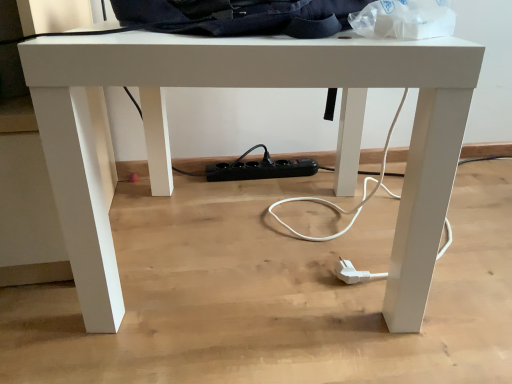
What do you see at coordinates (239, 16) in the screenshot?
I see `dark blue fabric messenger bag at upper center` at bounding box center [239, 16].

Identify the location of dark blue fabric messenger bag at upper center. (239, 16).

The image size is (512, 384). Identify the location of transparent plastic bag at upper right. pyautogui.click(x=404, y=19).

Describe the element at coordinates (404, 19) in the screenshot. Image resolution: width=512 pixels, height=384 pixels. I see `transparent plastic bag at upper right` at that location.

Identify the location of dark blue fabric messenger bag at upper center. The image size is (512, 384). (239, 16).

Can you confirm if dark blue fabric messenger bag at upper center is positioned to the right of transparent plastic bag at upper right?

No.

Between dark blue fabric messenger bag at upper center and transparent plastic bag at upper right, which one is positioned behind?

dark blue fabric messenger bag at upper center.

Between point (354, 6) and point (387, 22), which one is positioned behind?

The point (354, 6) is farther.

From the image's perspective, between dark blue fabric messenger bag at upper center and transparent plastic bag at upper right, who is located below?

transparent plastic bag at upper right is shown below in the image.

From a real-world perspective, is dark blue fabric messenger bag at upper center positioned above or below transparent plastic bag at upper right?

Clearly, from a real-world perspective, dark blue fabric messenger bag at upper center is above transparent plastic bag at upper right.

Does dark blue fabric messenger bag at upper center have a greater width compared to transparent plastic bag at upper right?

Correct, the width of dark blue fabric messenger bag at upper center exceeds that of transparent plastic bag at upper right.

Is dark blue fabric messenger bag at upper center taller than transparent plastic bag at upper right?

Incorrect, the height of dark blue fabric messenger bag at upper center is not larger of that of transparent plastic bag at upper right.

Considering the sizes of objects dark blue fabric messenger bag at upper center and transparent plastic bag at upper right in the image provided, who is bigger, dark blue fabric messenger bag at upper center or transparent plastic bag at upper right?

dark blue fabric messenger bag at upper center.

Is dark blue fabric messenger bag at upper center positioned beyond the bounds of transparent plastic bag at upper right?

Yes, dark blue fabric messenger bag at upper center is located beyond the bounds of transparent plastic bag at upper right.

Is dark blue fabric messenger bag at upper center far from transparent plastic bag at upper right?

No, dark blue fabric messenger bag at upper center is not far away from transparent plastic bag at upper right.

Does dark blue fabric messenger bag at upper center turn towards transparent plastic bag at upper right?

Yes, dark blue fabric messenger bag at upper center faces towards transparent plastic bag at upper right.

How many degrees apart are the facing directions of dark blue fabric messenger bag at upper center and transparent plastic bag at upper right?

They differ by 0.0001 degrees in their facing directions.

This screenshot has height=384, width=512. Find the location of `paper bag in front of the dark blue fabric messenger bag at upper center`. paper bag in front of the dark blue fabric messenger bag at upper center is located at coordinates (404, 19).

Considering the relative positions of transparent plastic bag at upper right and dark blue fabric messenger bag at upper center in the image provided, is transparent plastic bag at upper right to the left or to the right of dark blue fabric messenger bag at upper center?

transparent plastic bag at upper right is to the right of dark blue fabric messenger bag at upper center.

Consider the image. Which object is more forward, transparent plastic bag at upper right or dark blue fabric messenger bag at upper center?

Positioned in front is transparent plastic bag at upper right.

Is point (412, 6) less distant than point (215, 33)?

Yes, point (412, 6) is in front of point (215, 33).

From the image's perspective, which is below, transparent plastic bag at upper right or dark blue fabric messenger bag at upper center?

transparent plastic bag at upper right, from the image's perspective.

From a real-world perspective, is transparent plastic bag at upper right above or below dark blue fabric messenger bag at upper center?

Clearly, from a real-world perspective, transparent plastic bag at upper right is below dark blue fabric messenger bag at upper center.

Can you confirm if transparent plastic bag at upper right is thinner than dark blue fabric messenger bag at upper center?

Yes, transparent plastic bag at upper right is thinner than dark blue fabric messenger bag at upper center.

From their relative heights in the image, would you say transparent plastic bag at upper right is taller or shorter than dark blue fabric messenger bag at upper center?

Clearly, transparent plastic bag at upper right is taller compared to dark blue fabric messenger bag at upper center.

Is transparent plastic bag at upper right bigger or smaller than dark blue fabric messenger bag at upper center?

Considering their sizes, transparent plastic bag at upper right takes up less space than dark blue fabric messenger bag at upper center.

Is transparent plastic bag at upper right located outside dark blue fabric messenger bag at upper center?

No, transparent plastic bag at upper right is not entirely external to dark blue fabric messenger bag at upper center.

Are transparent plastic bag at upper right and dark blue fabric messenger bag at upper center far apart?

No.

Is transparent plastic bag at upper right aimed at dark blue fabric messenger bag at upper center?

Yes, transparent plastic bag at upper right is aimed at dark blue fabric messenger bag at upper center.

What's the angular difference between transparent plastic bag at upper right and dark blue fabric messenger bag at upper center's facing directions?

The angular difference between transparent plastic bag at upper right and dark blue fabric messenger bag at upper center is 0.0001 degrees.

This screenshot has width=512, height=384. Identify the location of messenger bag behind the transparent plastic bag at upper right. (239, 16).

The height and width of the screenshot is (384, 512). What are the coordinates of `paper bag lying below the dark blue fabric messenger bag at upper center (from the image's perspective)` in the screenshot? It's located at (404, 19).

Identify the location of messenger bag on the left of transparent plastic bag at upper right. (239, 16).